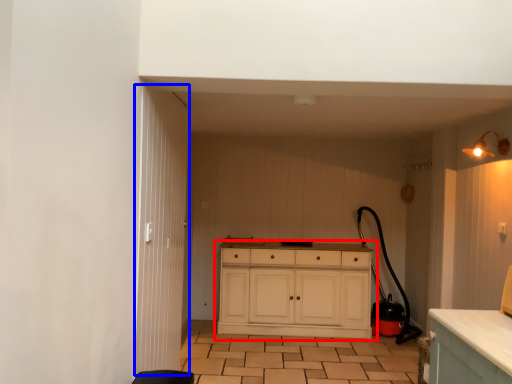
Question: Which object appears farthest to the camera in this image, chest of drawers (highlighted by a red box) or door (highlighted by a blue box)?

Choices:
 (A) chest of drawers
 (B) door

Answer: (A)